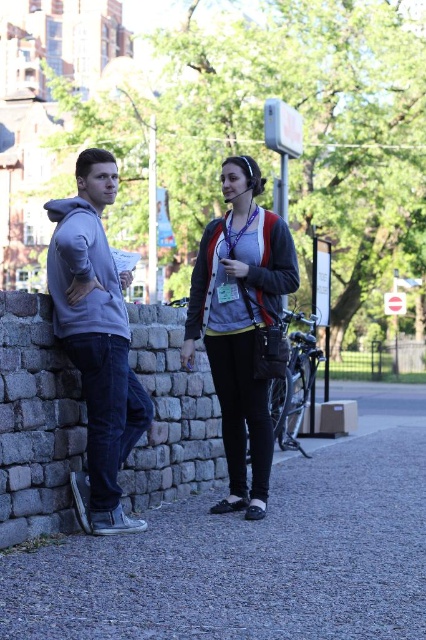
You are designing a new clothing line and want to ensure that the matte black jacket at center and the matte gray hoodie at left can be worn together. Based on their widths, which one should be placed on top to create a balanced look?

The matte black jacket at center has a smaller width than the matte gray hoodie at left, so placing the matte black jacket at center over the matte gray hoodie at left would create a balanced look by allowing the wider hoodie to show beneath it.

You are a delivery person who needs to place a package on the gray gravel pavement at lower center. The package is 1.2 meters tall. Will the gray hoodie at left block the delivery area?

The gray gravel pavement at lower center is shorter than the gray hoodie at left, meaning the gray hoodie at left is taller. Since the package is 1.2 meters tall, the gray hoodie at left may block the delivery area if it exceeds that height, but the exact height isn

You are standing in front of the two people in the image. You need to determine which of the two points, point (357, 589) or point (207, 301), is closer to you. Which one is closer?

Point (357, 589) is closer to the viewer than point (207, 301).